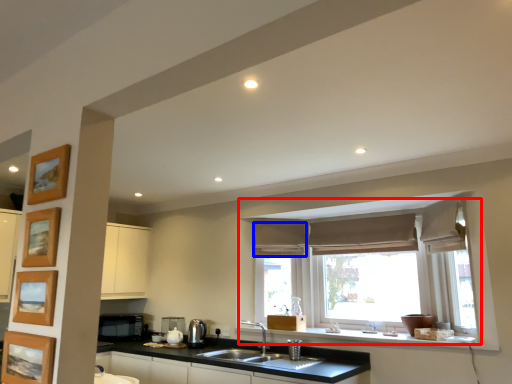
Question: Which of the following is the closest to the observer, window (highlighted by a red box) or curtain (highlighted by a blue box)?

Choices:
 (A) window
 (B) curtain

Answer: (A)